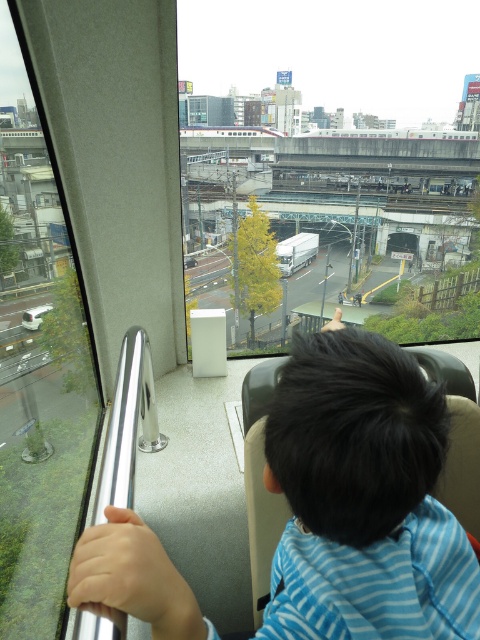
Question: Can you confirm if blue striped shirt at center is wider than transparent glass train window at left?

Choices:
 (A) yes
 (B) no

Answer: (B)

Question: Where is blue striped shirt at center located in relation to transparent glass train window at left in the image?

Choices:
 (A) above
 (B) below

Answer: (B)

Question: Is blue striped shirt at center to the right of transparent glass train window at left from the viewer's perspective?

Choices:
 (A) no
 (B) yes

Answer: (B)

Question: Among these objects, which one is nearest to the camera?

Choices:
 (A) transparent glass train window at left
 (B) blue striped shirt at center

Answer: (B)